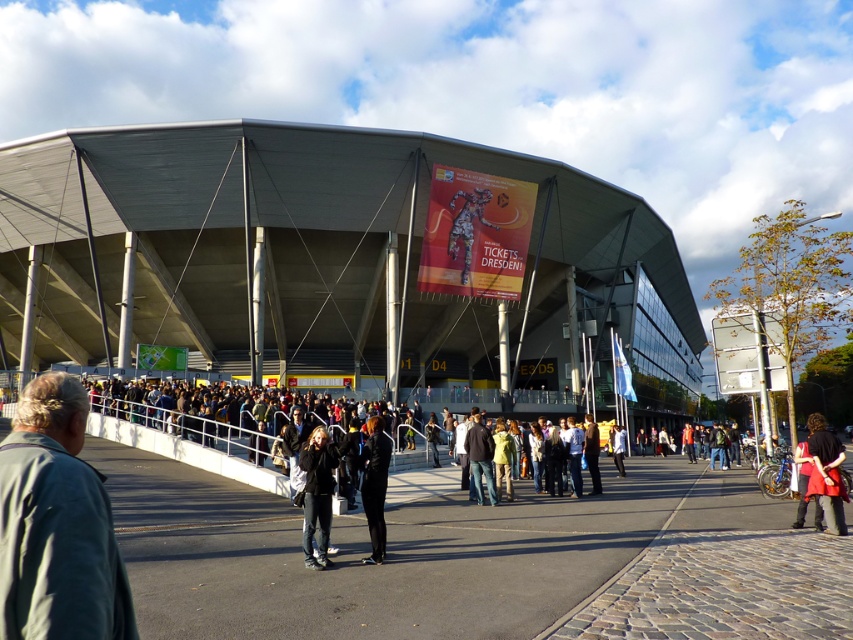
Question: Which of the following is the farthest from the observer?

Choices:
 (A) gray metallic stadium at center
 (B) jeans at center
 (C) red fabric coat at lower right

Answer: (A)

Question: Which point is farther to the camera?

Choices:
 (A) light brown leather jacket at center
 (B) gray metallic stadium at center
 (C) red fabric coat at lower right
 (D) dark gray hoodie at center

Answer: (B)

Question: Can you confirm if dark gray jacket at lower left is thinner than jeans at center?

Choices:
 (A) no
 (B) yes

Answer: (A)

Question: Which object appears farthest from the camera in this image?

Choices:
 (A) red fabric coat at lower right
 (B) black fabric pants at center

Answer: (A)

Question: Can you confirm if gray metallic stadium at center is positioned to the right of red fabric coat at lower right?

Choices:
 (A) no
 (B) yes

Answer: (B)

Question: Can you confirm if gray metallic stadium at center is smaller than black fabric pants at center?

Choices:
 (A) no
 (B) yes

Answer: (A)